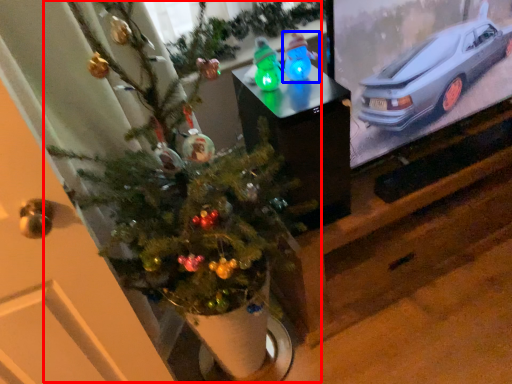
Question: Which object appears closest to the camera in this image, christmas tree (highlighted by a red box) or toy (highlighted by a blue box)?

Choices:
 (A) christmas tree
 (B) toy

Answer: (A)